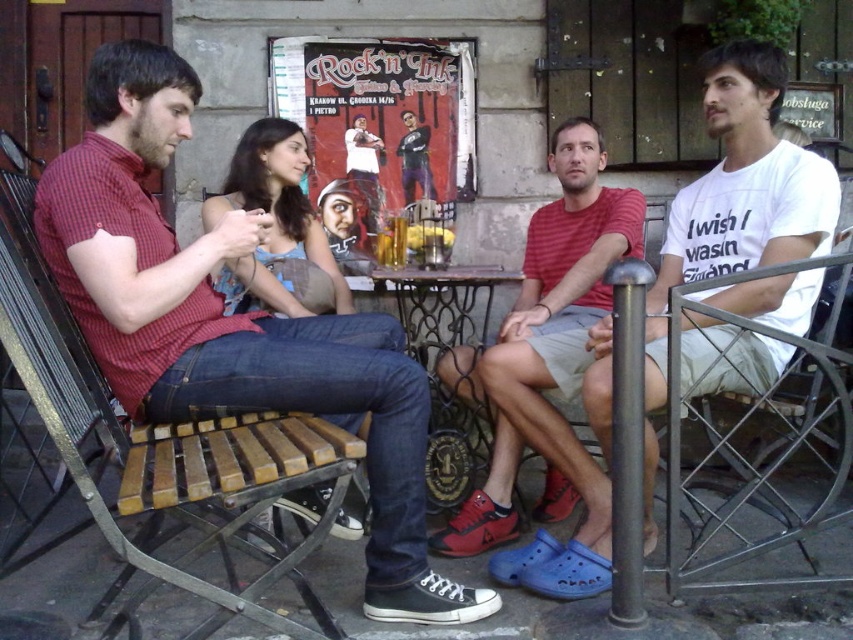
Question: From the image, what is the correct spatial relationship of wooden slats chair at left in relation to metallic wire chair at right?

Choices:
 (A) below
 (B) above

Answer: (B)

Question: Among these objects, which one is farthest from the camera?

Choices:
 (A) metallic wrought iron table at center
 (B) red striped shirt at center

Answer: (A)

Question: Is metallic wire chair at right thinner than metallic wrought iron table at center?

Choices:
 (A) yes
 (B) no

Answer: (B)

Question: Can you confirm if white cotton t-shirt at center is positioned above wooden slats chair at left?

Choices:
 (A) yes
 (B) no

Answer: (A)

Question: Among these points, which one is farthest from the camera?

Choices:
 (A) (747, 481)
 (B) (381, 280)
 (C) (589, 147)
 (D) (756, 70)

Answer: (B)

Question: Which of the following is the closest to the observer?

Choices:
 (A) wooden slats chair at left
 (B) white cotton t-shirt at center
 (C) metallic wrought iron table at center
 (D) red striped shirt at center

Answer: (A)